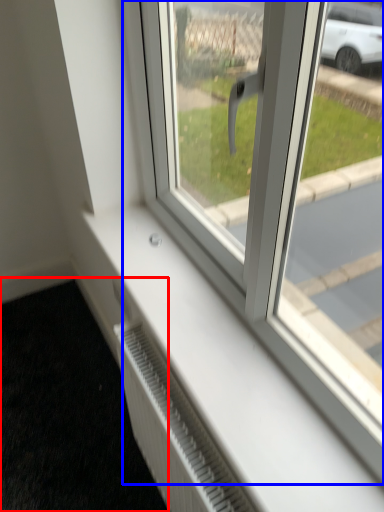
Question: Which object is further to the camera taking this photo, pavement (highlighted by a red box) or window (highlighted by a blue box)?

Choices:
 (A) pavement
 (B) window

Answer: (A)